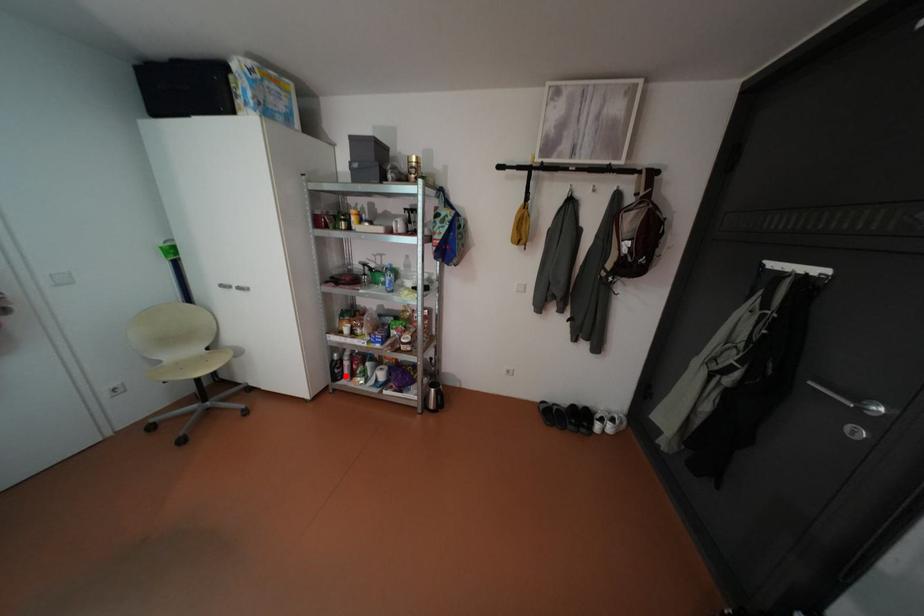
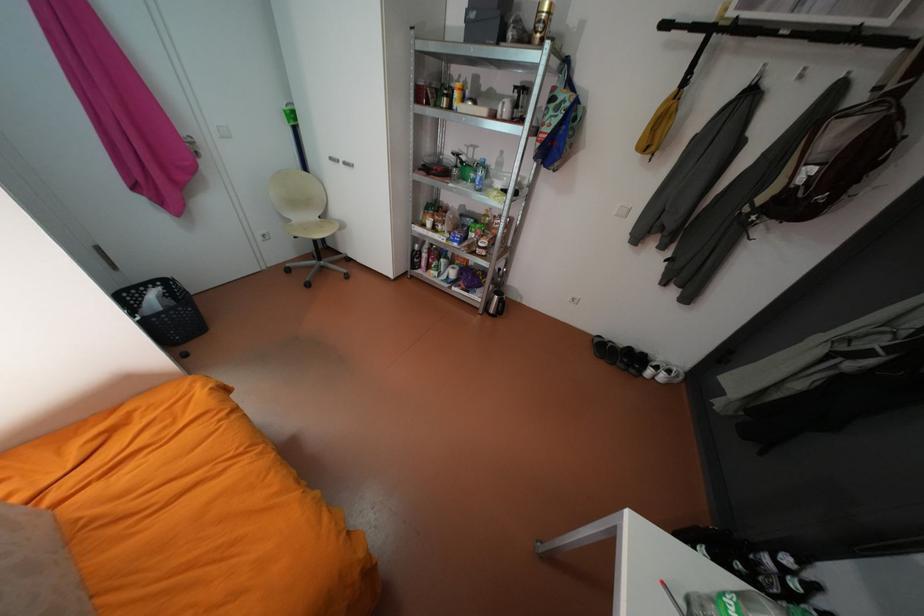
In the second image, find the point that corresponds to the highlighted location in the first image.

(423, 265)